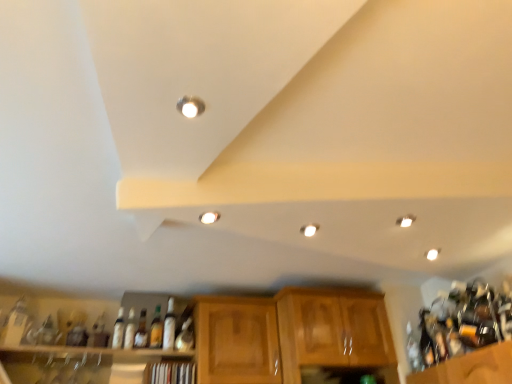
Locate an element on the screen. This screenshot has width=512, height=384. matte glass bottle at center, acting as the 7th bottle starting from the left is located at coordinates (185, 336).

How much space does matte glass bottle at center, which ranks as the second bottle in right-to-left order, occupy vertically?

matte glass bottle at center, which ranks as the second bottle in right-to-left order, is 18.62 centimeters tall.

Describe the element at coordinates (405, 220) in the screenshot. Image resolution: width=512 pixels, height=384 pixels. I see `white glossy light fixture at upper right, placed as the third lighting when sorted from top to bottom` at that location.

The image size is (512, 384). What do you see at coordinates (413, 350) in the screenshot? I see `clear glass bottle at right, the first bottle positioned from the right` at bounding box center [413, 350].

Image resolution: width=512 pixels, height=384 pixels. In order to click on white glossy light fixture at center, the 2th lighting when ordered from right to left in this screenshot , I will do `click(309, 230)`.

From a real-world perspective, which object stands above the other?

translucent glass bottle at center is physically above.

Is translucent glass bottle at center, arranged as the third bottle when viewed from the left, facing towards translucent glass bottle at center?

No, translucent glass bottle at center, arranged as the third bottle when viewed from the left, is not turned towards translucent glass bottle at center.

Can you confirm if translucent glass bottle at center, arranged as the third bottle when viewed from the left, is thinner than translucent glass bottle at center?

Indeed, translucent glass bottle at center, arranged as the third bottle when viewed from the left, has a lesser width compared to translucent glass bottle at center.

Considering the relative sizes of translucent glass bottle at center, arranged as the third bottle when viewed from the left, and translucent glass bottle at center in the image provided, is translucent glass bottle at center, arranged as the third bottle when viewed from the left, shorter than translucent glass bottle at center?

Yes.

Considering the positions of point (185, 111) and point (177, 341), is point (185, 111) closer or farther from the camera than point (177, 341)?

Point (185, 111) is positioned closer to the camera compared to point (177, 341).

From the image's perspective, relative to matte glass bottle at center, acting as the 7th bottle starting from the left, is matte silver light fixture at upper center, which is counted as the first lighting, starting from the front, above or below?

From the image's perspective, matte silver light fixture at upper center, which is counted as the first lighting, starting from the front, appears above matte glass bottle at center, acting as the 7th bottle starting from the left.

I want to click on bottle that is the 7th object located below the matte silver light fixture at upper center, placed as the fourth lighting when sorted from back to front (from the image's perspective), so click(x=185, y=336).

Is the surface of matte silver light fixture at upper center, placed as the fourth lighting when sorted from back to front, in direct contact with matte glass bottle at center, acting as the 7th bottle starting from the left?

No.

Considering the relative sizes of wooden shelf at lower center, marked as the 1th shelf in a right-to-left arrangement, and translucent glass bottle at center, acting as the 6th bottle starting from the right, in the image provided, is wooden shelf at lower center, marked as the 1th shelf in a right-to-left arrangement, shorter than translucent glass bottle at center, acting as the 6th bottle starting from the right,?

Yes.

Which object is thinner, wooden shelf at lower center, the second shelf in the left-to-right sequence, or translucent glass bottle at center, acting as the 6th bottle starting from the right?

Thinner between the two is translucent glass bottle at center, acting as the 6th bottle starting from the right.

Considering the points (154, 368) and (119, 342), which point is behind, point (154, 368) or point (119, 342)?

Positioned behind is point (154, 368).

Is white glossy light fixture at center, which is the 2th lighting from top to bottom, closer to camera compared to clear glass bottle at right, which appears as the eighth bottle when viewed from the left?

Yes.

From the image's perspective, is white glossy light fixture at center, which is the 2th lighting from top to bottom, located above or below clear glass bottle at right, the first bottle positioned from the right?

Clearly, from the image's perspective, white glossy light fixture at center, which is the 2th lighting from top to bottom, is above clear glass bottle at right, the first bottle positioned from the right.

From a real-world perspective, is white glossy light fixture at center, which is the 2th lighting from top to bottom, physically above clear glass bottle at right, which appears as the eighth bottle when viewed from the left?

Yes, from a real-world perspective, white glossy light fixture at center, which is the 2th lighting from top to bottom, is above clear glass bottle at right, which appears as the eighth bottle when viewed from the left.

Who is shorter, white glossy light fixture at center, the second lighting from the left, or clear glass bottle at right, the first bottle positioned from the right?

white glossy light fixture at center, the second lighting from the left.

How different are the orientations of white glossy light fixture at center, placed as the 3th lighting when sorted from back to front, and translucent glass bottle at center in degrees?

0.624 degrees separate the facing orientations of white glossy light fixture at center, placed as the 3th lighting when sorted from back to front, and translucent glass bottle at center.

Based on the photo, is white glossy light fixture at center, which is counted as the 3th lighting, starting from the bottom, located outside translucent glass bottle at center?

Yes, white glossy light fixture at center, which is counted as the 3th lighting, starting from the bottom, is located beyond the bounds of translucent glass bottle at center.

From the picture: From the image's perspective, is white glossy light fixture at center, the second lighting from the left, on top of translucent glass bottle at center?

Correct, white glossy light fixture at center, the second lighting from the left, appears higher than translucent glass bottle at center in the image.

From a real-world perspective, is white glossy light fixture at center, the third lighting when ordered from right to left, beneath translucent glass bottle at center?

No, from a real-world perspective, white glossy light fixture at center, the third lighting when ordered from right to left, is not beneath translucent glass bottle at center.

Is wooden cabinet at center, the first cabinetry viewed from the right, wider than white glossy light fixture at center, which is counted as the 3th lighting, starting from the bottom?

Correct, the width of wooden cabinet at center, the first cabinetry viewed from the right, exceeds that of white glossy light fixture at center, which is counted as the 3th lighting, starting from the bottom.

Is the position of wooden cabinet at center, the first cabinetry viewed from the right, more distant than that of white glossy light fixture at center, which is the 2th lighting in front-to-back order?

Yes, it is.

Does point (279, 304) come farther from viewer compared to point (211, 219)?

Yes, it is.

Which of these two, matte glass bottle at center, which ranks as the second bottle in right-to-left order, or white glossy light fixture at center, placed as the 3th lighting when sorted from back to front, stands taller?

Standing taller between the two is matte glass bottle at center, which ranks as the second bottle in right-to-left order.

The height and width of the screenshot is (384, 512). I want to click on the 3rd lighting in front of the matte glass bottle at center, acting as the 7th bottle starting from the left, counting from the anchor's position, so click(209, 217).

Who is more distant, matte glass bottle at center, which ranks as the second bottle in right-to-left order, or white glossy light fixture at center, the second lighting from the left?

matte glass bottle at center, which ranks as the second bottle in right-to-left order, is further away from the camera.

Is matte glass bottle at center, which ranks as the second bottle in right-to-left order, in contact with white glossy light fixture at center, the second lighting from the left?

No, matte glass bottle at center, which ranks as the second bottle in right-to-left order, is not touching white glossy light fixture at center, the second lighting from the left.

Image resolution: width=512 pixels, height=384 pixels. What are the coordinates of `the 3rd bottle above when counting from the translucent glass bottle at center (from the image's perspective)` in the screenshot? It's located at (118, 330).

Locate an element on the screen. the 6th bottle positioned below the matte silver light fixture at upper center, which is counted as the first lighting, starting from the front (from a real-world perspective) is located at coordinates (185, 336).

Looking at the image, which one is located closer to matte glass bottle at center, which ranks as the second bottle in right-to-left order, matte glass bottle at lower left, arranged as the 8th bottle when viewed from the right, or translucent glass bottle at center?

Based on the image, translucent glass bottle at center appears to be nearer to matte glass bottle at center, which ranks as the second bottle in right-to-left order.

Which object lies further to the anchor point clear glass bottle at right, which appears as the eighth bottle when viewed from the left, white glossy bottle at center, which is counted as the fourth bottle, starting from the left, or translucent glass bottle at center?

white glossy bottle at center, which is counted as the fourth bottle, starting from the left, lies further to clear glass bottle at right, which appears as the eighth bottle when viewed from the left, than the other object.

From the image, which object appears to be nearer to wooden cabinet at center, positioned as the 2th cabinetry in right-to-left order, translucent glass bottle at center or translucent glass bottle at center, which is the 2th bottle from left to right?

Among the two, translucent glass bottle at center is located nearer to wooden cabinet at center, positioned as the 2th cabinetry in right-to-left order.

Looking at the image, which one is located further to matte glass bottle at center, marked as the 4th bottle in a right-to-left arrangement, white glossy light fixture at center, positioned as the second lighting in back-to-front order, or white glossy bottle at center, which is counted as the fourth bottle, starting from the left?

white glossy light fixture at center, positioned as the second lighting in back-to-front order, lies further to matte glass bottle at center, marked as the 4th bottle in a right-to-left arrangement, than the other object.

Which object lies further to the anchor point white glossy bottle at center, which is counted as the fourth bottle, starting from the left, translucent glass bottle at center, acting as the 6th bottle starting from the right, or matte silver light fixture at upper center, which is counted as the first lighting, starting from the front?

Based on the image, matte silver light fixture at upper center, which is counted as the first lighting, starting from the front, appears to be further to white glossy bottle at center, which is counted as the fourth bottle, starting from the left.

Estimate the real-world distances between objects in this image. Which object is further from matte glass bottle at lower left, marked as the 1th bottle in a left-to-right arrangement, matte silver light fixture at upper center, placed as the fourth lighting when sorted from bottom to top, or matte glass bottle at center, the 6th bottle in the left-to-right sequence?

The object further to matte glass bottle at lower left, marked as the 1th bottle in a left-to-right arrangement, is matte silver light fixture at upper center, placed as the fourth lighting when sorted from bottom to top.

From the image, which object appears to be nearer to matte glass bottle at center, marked as the 4th bottle in a right-to-left arrangement, white glossy bottle at center, the fifth bottle positioned from the right, or translucent glass bottle at center, the 7th bottle from the right?

white glossy bottle at center, the fifth bottle positioned from the right, is positioned closer to the anchor matte glass bottle at center, marked as the 4th bottle in a right-to-left arrangement.

Considering their positions, is wooden at upper center, which appears as the 1th shelf when viewed from the left, positioned further to wooden cabinet at center, positioned as the 2th cabinetry in right-to-left order, than wooden shelf at lower center, marked as the 1th shelf in a right-to-left arrangement?

The object further to wooden cabinet at center, positioned as the 2th cabinetry in right-to-left order, is wooden at upper center, which appears as the 1th shelf when viewed from the left.

The image size is (512, 384). Identify the location of cabinetry between matte glass bottle at lower left, arranged as the 8th bottle when viewed from the right, and white glossy light fixture at center, which is the 2th lighting in front-to-back order. (236, 340).

The width and height of the screenshot is (512, 384). I want to click on beverage between wooden at upper center, the 2th shelf when ordered from right to left, and white glossy light fixture at upper right, which is the 2th lighting in bottom-to-top order, in the horizontal direction, so click(x=156, y=329).

Find the location of `beverage between matte glass bottle at lower left, marked as the 1th bottle in a left-to-right arrangement, and wooden shelf at lower center, marked as the 1th shelf in a right-to-left arrangement, in the horizontal direction`. beverage between matte glass bottle at lower left, marked as the 1th bottle in a left-to-right arrangement, and wooden shelf at lower center, marked as the 1th shelf in a right-to-left arrangement, in the horizontal direction is located at coordinates (156, 329).

At what (x,y) coordinates should I click in order to perform the action: click on beverage between white glossy light fixture at center, which is counted as the 3th lighting, starting from the bottom, and wooden shelf at lower center, marked as the 1th shelf in a right-to-left arrangement, from top to bottom. Please return your answer as a coordinate pair (x, y). The width and height of the screenshot is (512, 384). Looking at the image, I should click on (156, 329).